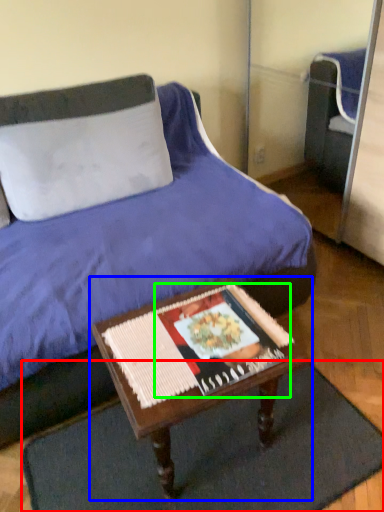
Question: Considering the real-world distances, which object is farthest from doormat (highlighted by a red box)? table (highlighted by a blue box) or magazine (highlighted by a green box)?

Choices:
 (A) table
 (B) magazine

Answer: (B)